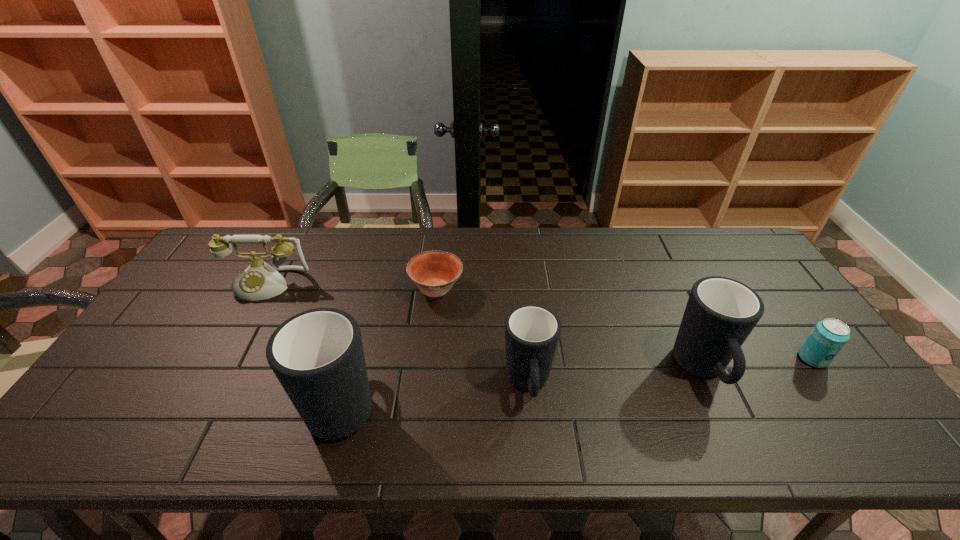
The image size is (960, 540). I want to click on vacant space at the far edge of the desktop, so click(405, 236).

In the image, there is a desktop. In order to click on vacant space at the near edge in this screenshot , I will do `click(180, 394)`.

Find the location of a particular element. vacant region at the left edge is located at coordinates (206, 280).

This screenshot has width=960, height=540. Identify the location of vacant space at the right edge of the desktop. (764, 282).

Find the location of a particular element. free location at the near left corner of the desktop is located at coordinates (95, 408).

The image size is (960, 540). What are the coordinates of `vacant area at the far right corner` in the screenshot? It's located at (720, 258).

Where is `vacant space that is in between the shortest mug and the bowl`? The height and width of the screenshot is (540, 960). vacant space that is in between the shortest mug and the bowl is located at coordinates (483, 336).

The image size is (960, 540). Identify the location of blank region between the fifth tallest object and the second mug from right to left. [x=670, y=372].

In order to click on free spot between the shortest mug and the fifth tallest object in this screenshot , I will do `click(670, 372)`.

Find the location of a particular element. empty space between the leftmost mug and the third object from right to left is located at coordinates (436, 392).